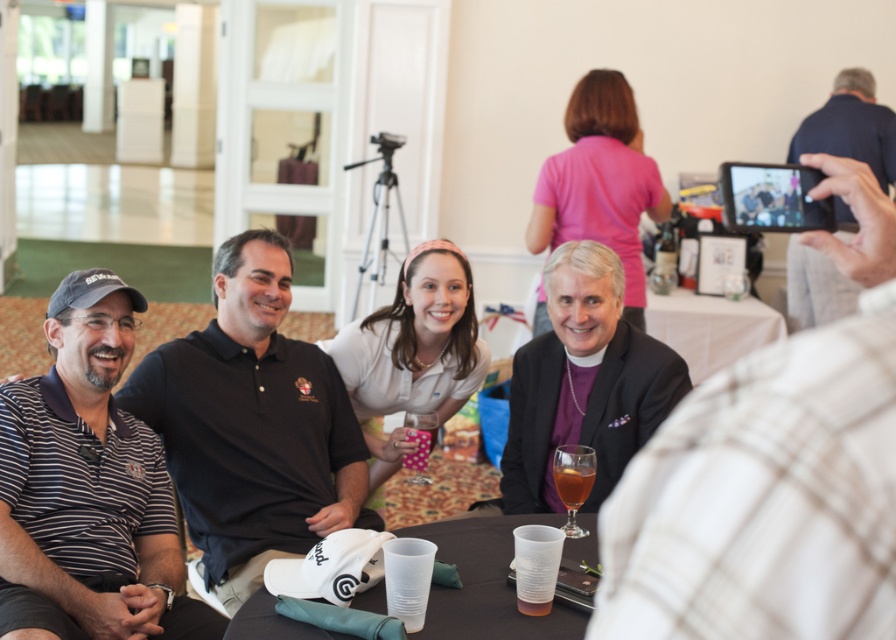
You are organizing a photo shoot and need to place a small decorative item next to the translucent plastic cup at table center. Considering the space available, will the dark blue shirt at upper right block access to the cup?

The dark blue shirt at upper right is wider than the translucent plastic cup at table center, so it might block access to the cup depending on their positioning.

You are organizing a small event and need to place a name tag on the dark brown polo shirt at left and a drink on the white plastic cups at lower center. Which item requires a larger label in terms of size?

The dark brown polo shirt at left requires a larger label because it has a larger size compared to the white plastic cups at lower center.